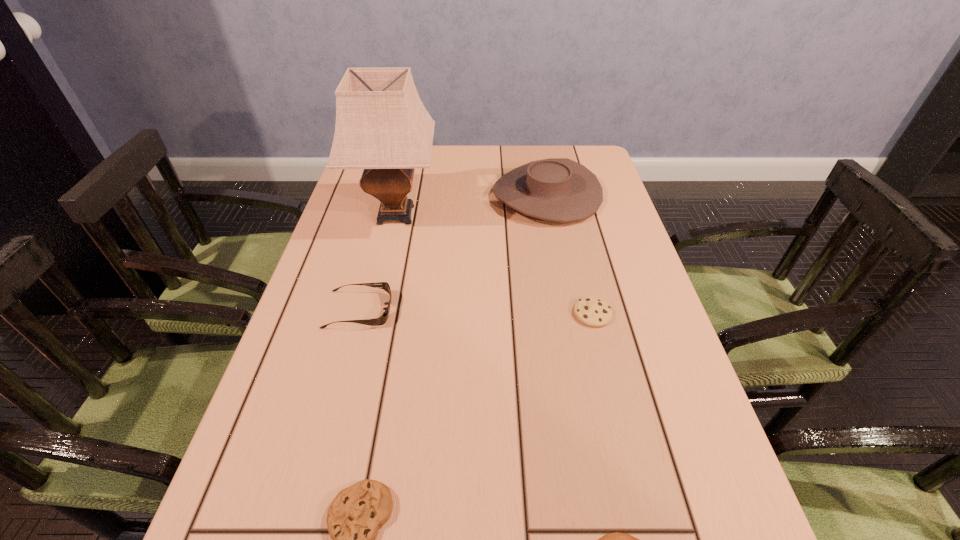
Locate an element on the screen. The height and width of the screenshot is (540, 960). lampshade is located at coordinates pos(382,126).

Image resolution: width=960 pixels, height=540 pixels. What are the coordinates of `cowboy hat` in the screenshot? It's located at (556, 189).

Identify the location of sunglasses. This screenshot has height=540, width=960. (382, 319).

The height and width of the screenshot is (540, 960). Find the location of `the farthest cookie`. the farthest cookie is located at coordinates (595, 312).

Locate an element on the screen. blank space located on the front of the lampshade is located at coordinates (372, 314).

Identify the location of vacant space positioned on the front of the second tallest object. (556, 239).

Where is `vacant area situated on the front-facing side of the sunglasses`? This screenshot has height=540, width=960. vacant area situated on the front-facing side of the sunglasses is located at coordinates (423, 310).

The image size is (960, 540). Find the location of `free space located on the back of the farthest cookie`. free space located on the back of the farthest cookie is located at coordinates (574, 239).

This screenshot has width=960, height=540. Find the location of `object that is at the far edge`. object that is at the far edge is located at coordinates (556, 189).

Image resolution: width=960 pixels, height=540 pixels. I want to click on lampshade that is at the left edge, so click(382, 126).